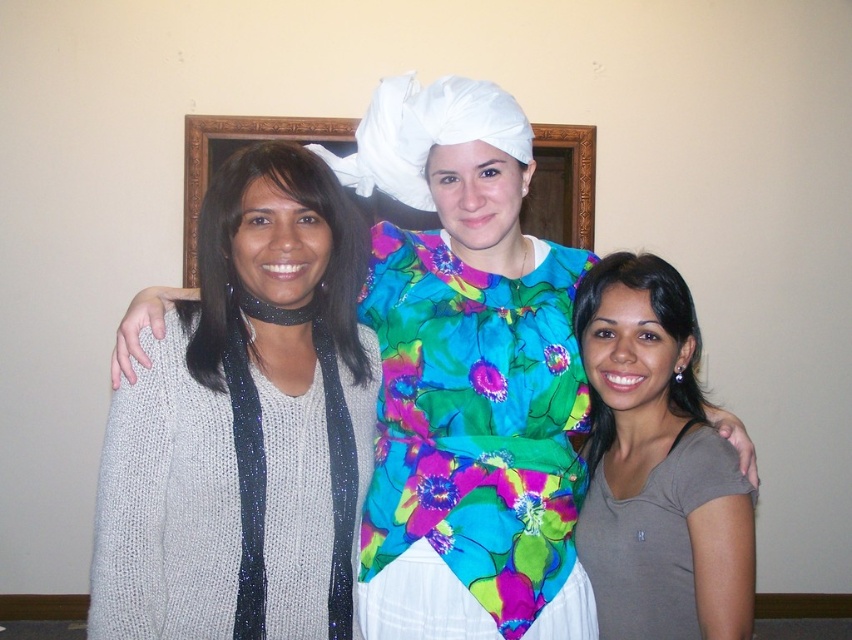
Does white knit dress at left appear over white fabric at center?

No.

In the scene shown: Between white knit dress at left and white fabric at center, which one is positioned lower?

white knit dress at left is below.

Where is `white knit dress at left`? The height and width of the screenshot is (640, 852). white knit dress at left is located at coordinates (223, 499).

Where is `white knit dress at left`? The image size is (852, 640). white knit dress at left is located at coordinates (223, 499).

This screenshot has width=852, height=640. I want to click on white satin turban at center, so click(467, 378).

Find the location of `white satin turban at center`. white satin turban at center is located at coordinates (467, 378).

Is white knit dress at left to the left of gray matte shirt at center from the viewer's perspective?

Correct, you'll find white knit dress at left to the left of gray matte shirt at center.

Can you confirm if white knit dress at left is positioned below gray matte shirt at center?

Indeed, white knit dress at left is positioned under gray matte shirt at center.

Which is in front, point (286, 573) or point (646, 465)?

Point (286, 573) is more forward.

Identify the location of white knit dress at left. This screenshot has height=640, width=852. (223, 499).